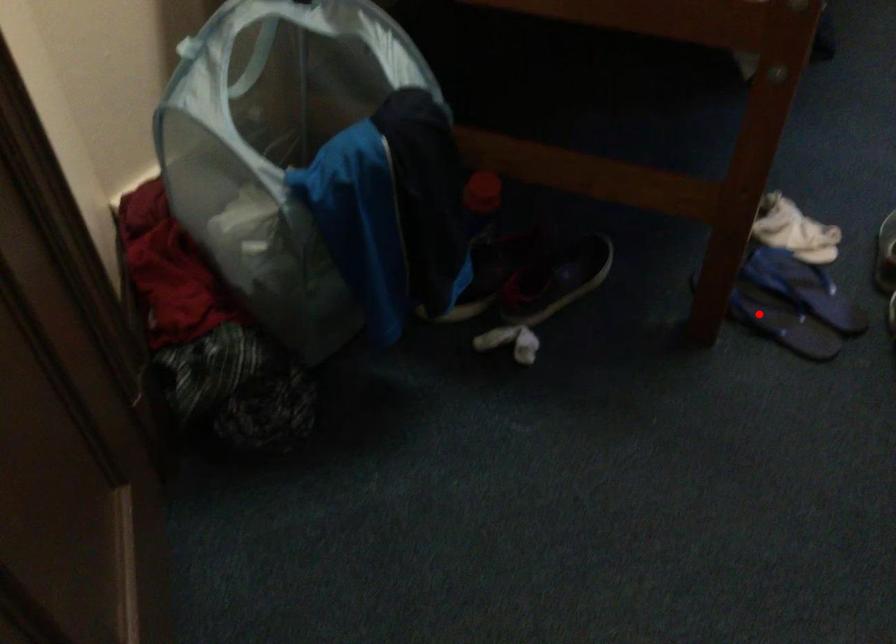
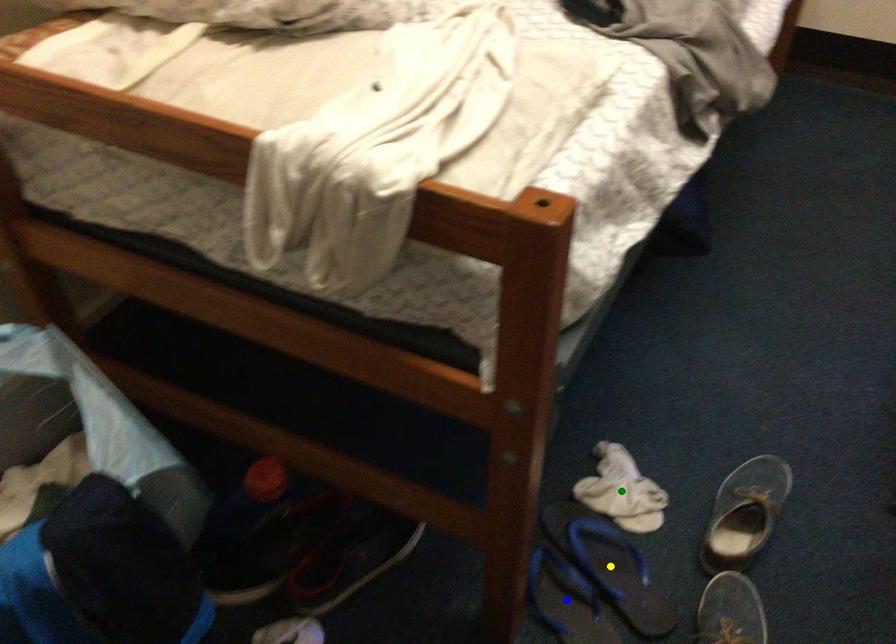
Question: I am providing you with two images of the same scene from different viewpoints. A red point is marked on the first image. You are given multiple points on the second image. Can you choose the point in image 2 that corresponds to the point in image 1?

Choices:
 (A) blue point
 (B) yellow point
 (C) green point

Answer: (A)